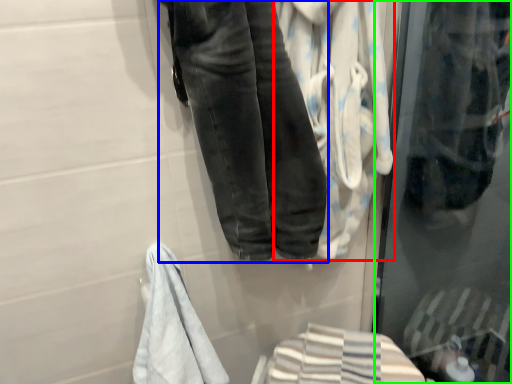
Question: Considering the real-world distances, which object is farthest from bath towel (highlighted by a red box)? trousers (highlighted by a blue box) or glass door (highlighted by a green box)?

Choices:
 (A) trousers
 (B) glass door

Answer: (B)